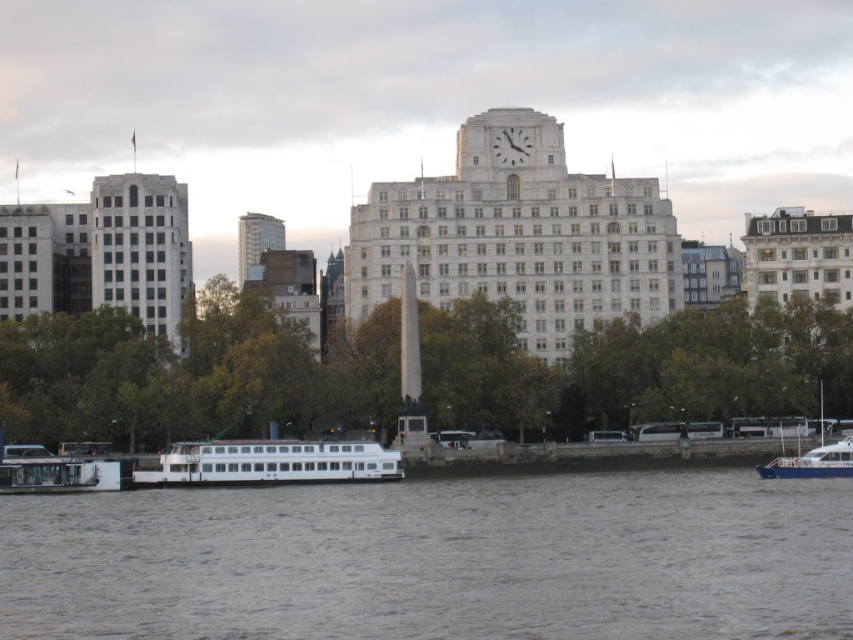
You are standing at the dock where the white ferry boat is located. You want to take a photo of the Cleopatra Needle monument. Which direction should you face to ensure the green leafy tree at center is not blocking your view?

You should face away from the green leafy tree at center, which is located at point (190, 376), to avoid it blocking the view of the Cleopatra Needle monument.

You are a tourist standing on the dock and want to take a photo of the white glossy boat at lower left and the gray water at lower center. Which object should you focus on first if you want both to be in clear view?

You should focus on the white glossy boat at lower left first because the gray water at lower center is positioned under it, so focusing on the boat will ensure the water below is also in focus.

Looking at this image, you are standing at the camera position and want to reach the point at coordinates (368,324). The maximum distance you can walk is 150 meters. Will you be able to reach it?

The point at coordinates (368,324) is 150.68 meters away from the camera. Since your maximum walking distance is 150 meters, you will not be able to reach it.